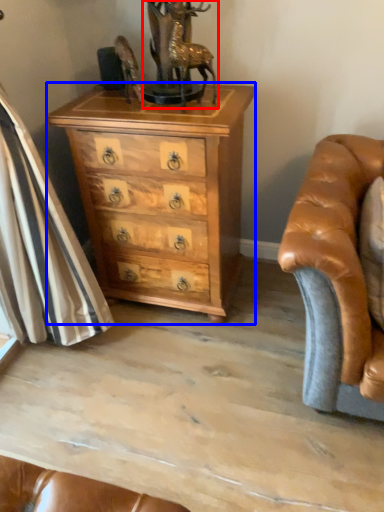
Question: Among these objects, which one is farthest to the camera, antique (highlighted by a red box) or chest of drawers (highlighted by a blue box)?

Choices:
 (A) antique
 (B) chest of drawers

Answer: (B)